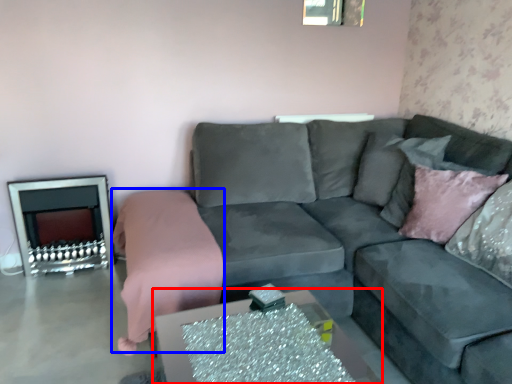
Question: Which of the following is the closest to the observer, table (highlighted by a red box) or bedding (highlighted by a blue box)?

Choices:
 (A) table
 (B) bedding

Answer: (A)